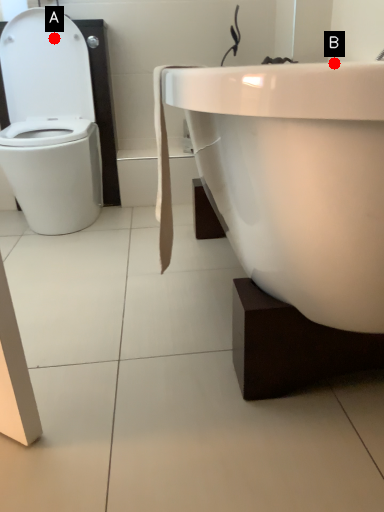
Question: Two points are circled on the image, labeled by A and B beside each circle. Which point is closer to the camera taking this photo?

Choices:
 (A) A is closer
 (B) B is closer

Answer: (A)